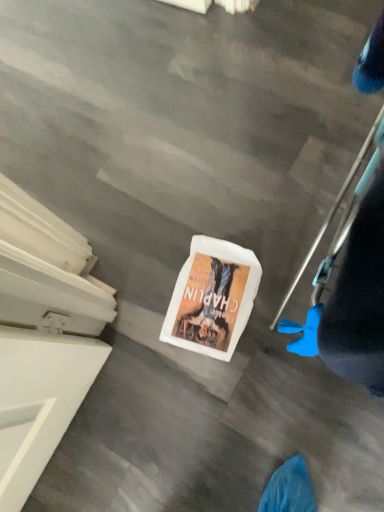
Identify the location of vacant space behind white matte book at center. This screenshot has width=384, height=512. (172, 217).